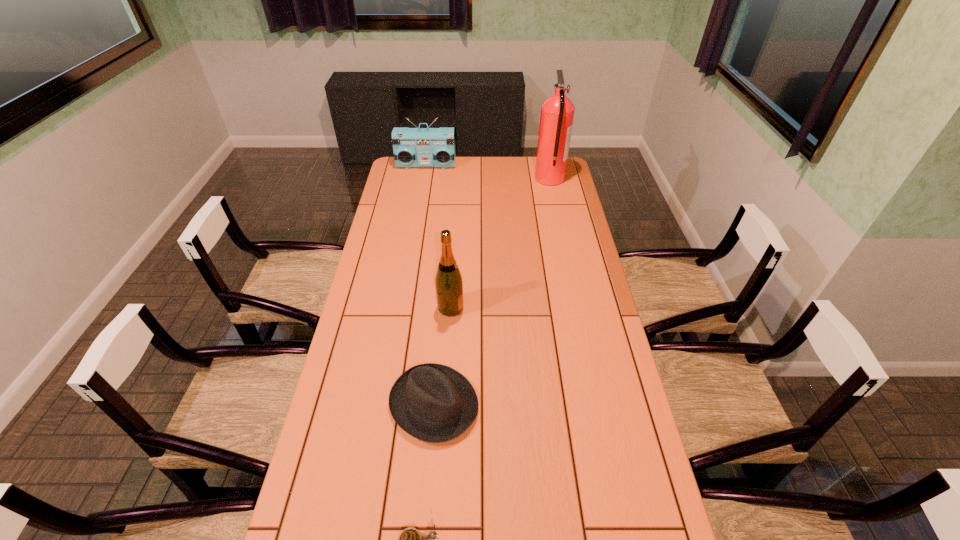
This screenshot has height=540, width=960. Find the location of `vacant space at the right edge`. vacant space at the right edge is located at coordinates (625, 397).

In the image, there is a desktop. What are the coordinates of `blank space at the far left corner` in the screenshot? It's located at (394, 163).

Where is `free spot between the rightmost object and the third tallest object`? The height and width of the screenshot is (540, 960). free spot between the rightmost object and the third tallest object is located at coordinates (488, 172).

Where is `empty location between the third farthest object and the third shortest object`? The width and height of the screenshot is (960, 540). empty location between the third farthest object and the third shortest object is located at coordinates (439, 236).

Image resolution: width=960 pixels, height=540 pixels. Identify the location of the fourth closest object to the nearest object. (413, 147).

Locate which object ranks second in proximity to the fedora. Please provide its 2D coordinates. Your answer should be formatted as a tuple, i.e. [(x, y)], where the tuple contains the x and y coordinates of a point satisfying the conditions above.

[(411, 539)]

Find the location of a particular element. This screenshot has height=540, width=960. vacant space that satisfies the following two spatial constraints: 1. on the front-facing side of the fedora; 2. on the left side of the radio receiver is located at coordinates (386, 404).

Locate an element on the screen. The height and width of the screenshot is (540, 960). vacant position in the image that satisfies the following two spatial constraints: 1. on the front-facing side of the fourth farthest object; 2. on the right side of the third tallest object is located at coordinates (386, 404).